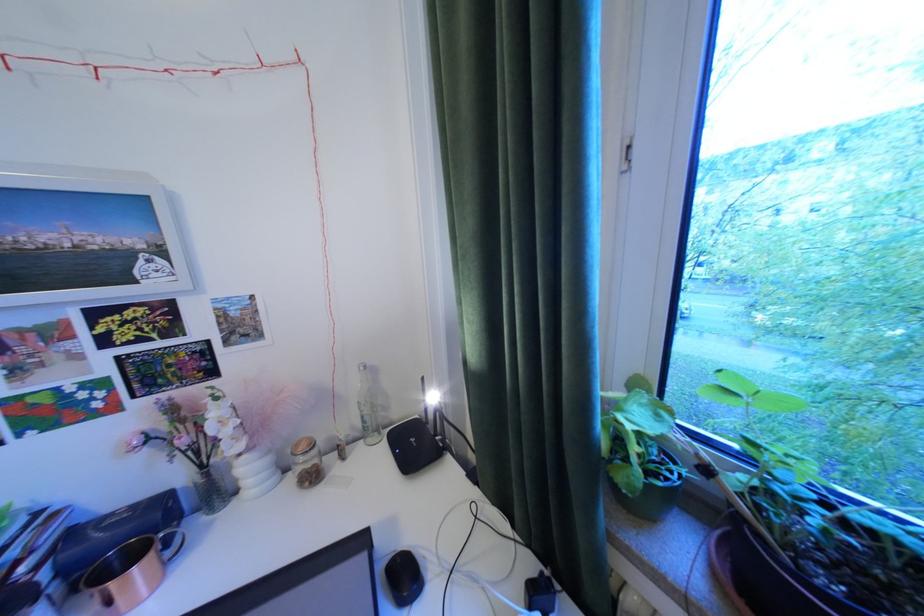
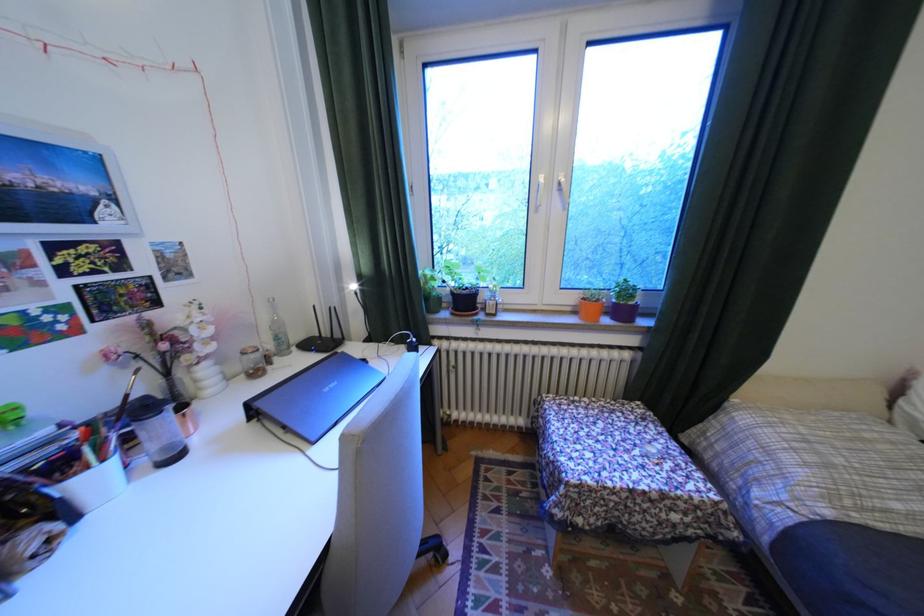
Question: The camera is either moving clockwise (left) or counter-clockwise (right) around the object. The first image is from the beginning of the video and the second image is from the end. Is the camera moving left or right when shooting the video?

Choices:
 (A) Left
 (B) Right

Answer: (A)